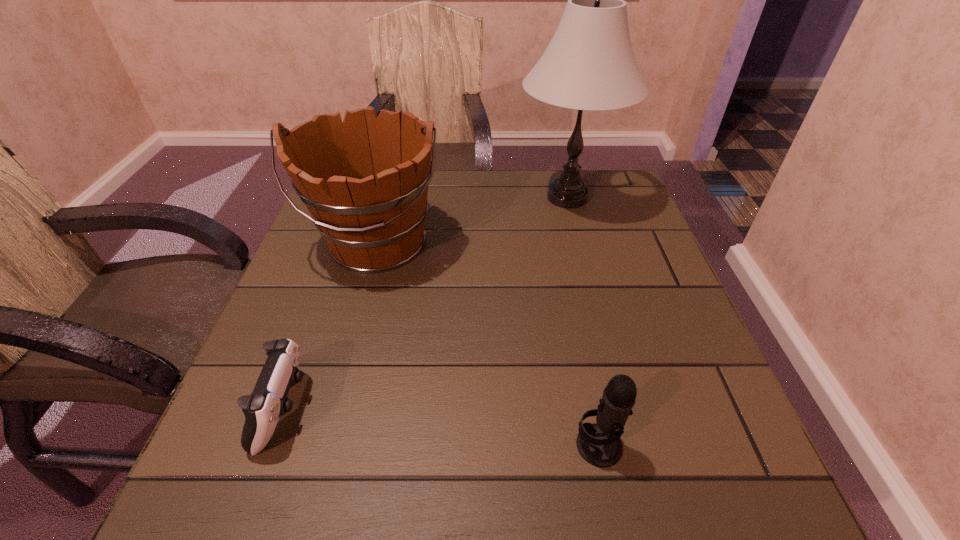
Where is `vacant space that satisfies the following two spatial constraints: 1. on the back side of the second shortest object; 2. on the front-facing side of the control`? This screenshot has height=540, width=960. vacant space that satisfies the following two spatial constraints: 1. on the back side of the second shortest object; 2. on the front-facing side of the control is located at coordinates (590, 409).

The width and height of the screenshot is (960, 540). Identify the location of free location that satisfies the following two spatial constraints: 1. on the front side of the tallest object; 2. on the front-facing side of the shortest object. (623, 409).

Image resolution: width=960 pixels, height=540 pixels. I want to click on free region that satisfies the following two spatial constraints: 1. on the front-facing side of the microphone; 2. on the left side of the control, so click(272, 446).

You are a GUI agent. You are given a task and a screenshot of the screen. Output one action in this format:
    pyautogui.click(x=<x>, y=<y>)
    Task: Click on the free spot that satisfies the following two spatial constraints: 1. with the handle on the third tallest object; 2. on the left side of the wine bucket
    Image resolution: width=960 pixels, height=540 pixels.
    Given the screenshot: What is the action you would take?
    pyautogui.click(x=322, y=446)

The image size is (960, 540). What are the coordinates of `free spot that satisfies the following two spatial constraints: 1. on the back side of the second shortest object; 2. on the front-facing side of the control` in the screenshot? It's located at (590, 409).

The width and height of the screenshot is (960, 540). I want to click on vacant space that satisfies the following two spatial constraints: 1. on the front-facing side of the shortest object; 2. on the left side of the microphone, so 272,446.